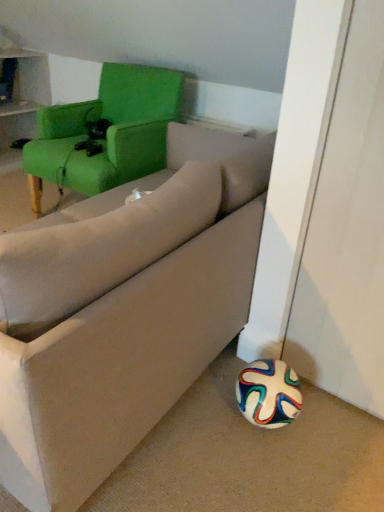
Question: Considering the relative positions of beige fabric pillow at center and beige fabric couch at lower right in the image provided, is beige fabric pillow at center to the left or to the right of beige fabric couch at lower right?

Choices:
 (A) left
 (B) right

Answer: (B)

Question: In terms of width, does beige fabric pillow at center look wider or thinner when compared to beige fabric couch at lower right?

Choices:
 (A) wide
 (B) thin

Answer: (B)

Question: Considering the real-world distances, which object is closest to the green fabric chair at upper left?

Choices:
 (A) beige fabric pillow at center
 (B) beige fabric couch at lower right

Answer: (B)

Question: Based on their relative distances, which object is farther from the beige fabric pillow at center?

Choices:
 (A) green fabric chair at upper left
 (B) beige fabric couch at lower right

Answer: (A)